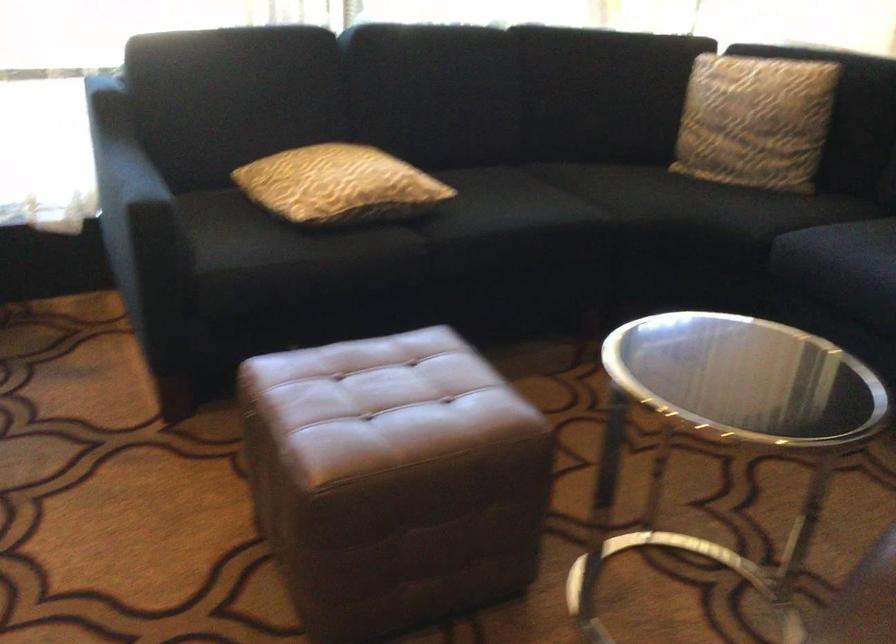
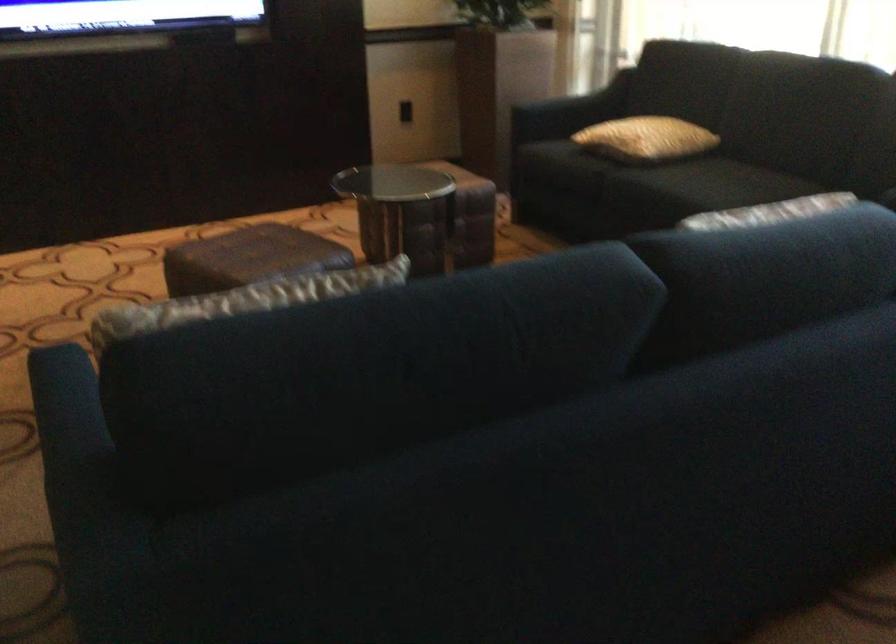
Where in the second image is the point corresponding to point (538, 200) from the first image?

(709, 184)